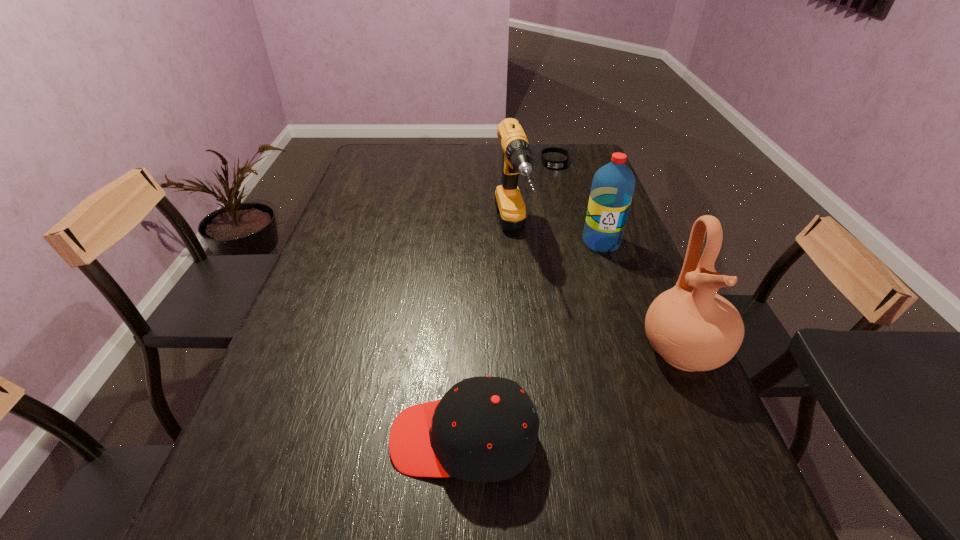
Where is `free space on the desktop that is between the cap and the pottery and is positioned on the display of the wristband`? free space on the desktop that is between the cap and the pottery and is positioned on the display of the wristband is located at coordinates (566, 397).

You are a GUI agent. You are given a task and a screenshot of the screen. Output one action in this format:
    pyautogui.click(x=<x>, y=<y>)
    Task: Click on the vacant space on the desktop that is between the cap and the second nearest object and is positioned at the tip of the drill
    The height and width of the screenshot is (540, 960).
    Given the screenshot: What is the action you would take?
    pyautogui.click(x=560, y=400)

What are the coordinates of `vacant space on the desktop that is between the cap and the second nearest object and is positioned on the front label of the water bottle` in the screenshot? It's located at (560, 400).